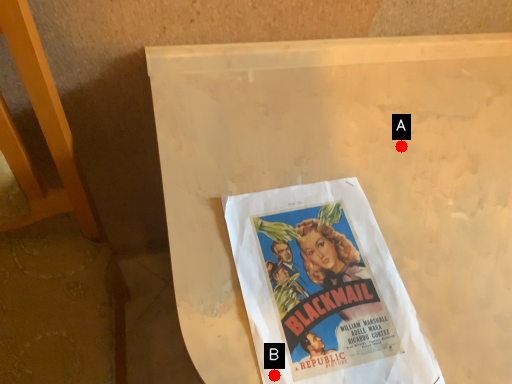
Question: Two points are circled on the image, labeled by A and B beside each circle. Which point appears farthest from the camera in this image?

Choices:
 (A) A is further
 (B) B is further

Answer: (A)